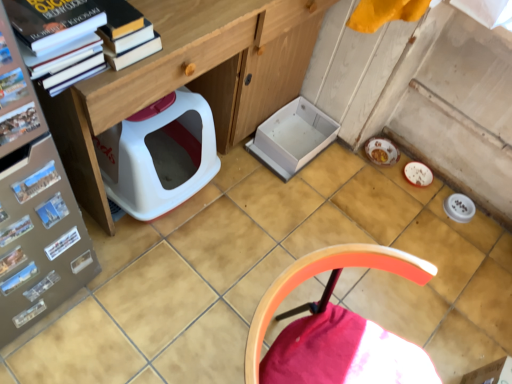
Find the location of a particular element. free space behind wooden chair at lower right is located at coordinates (311, 276).